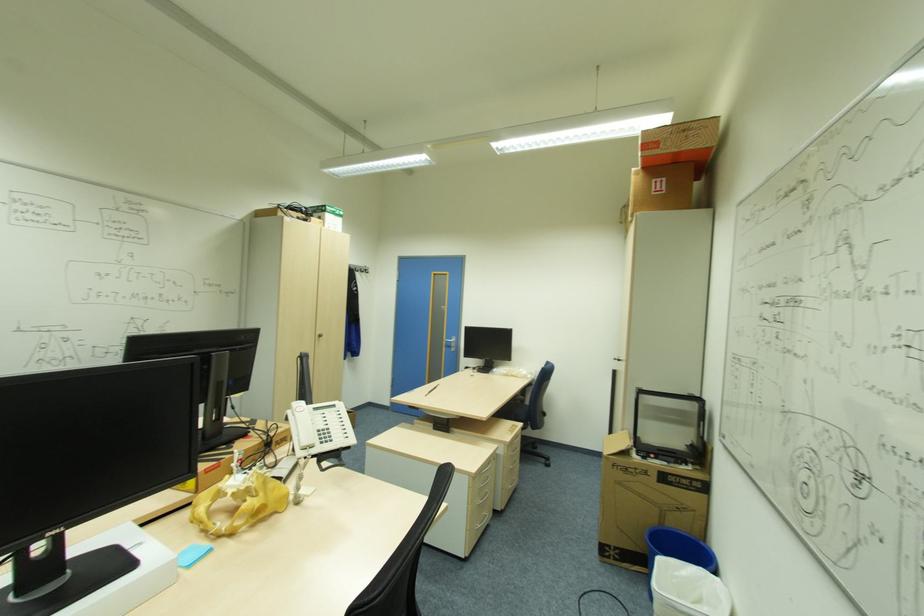
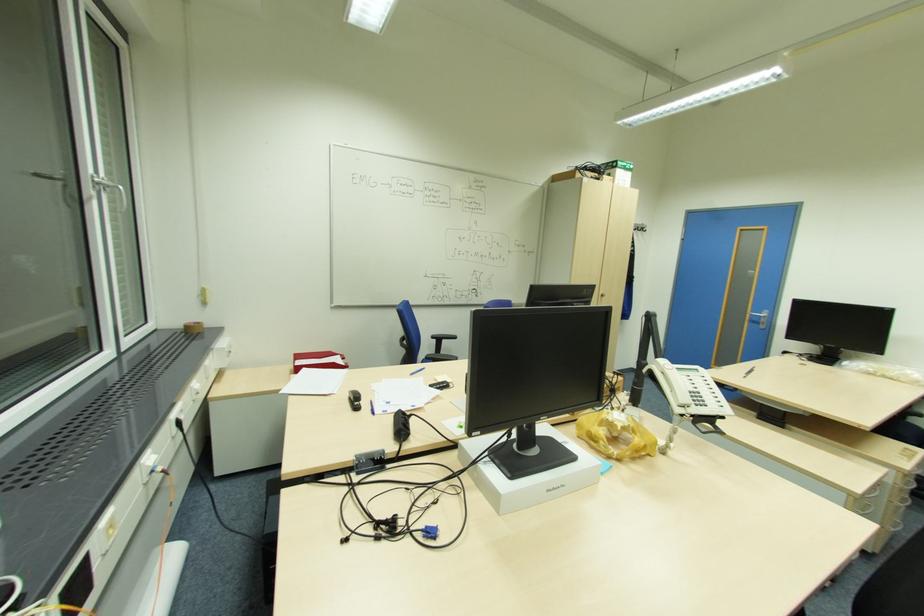
In the second image, find the point that corresponds to [322,334] in the first image.

(604, 294)